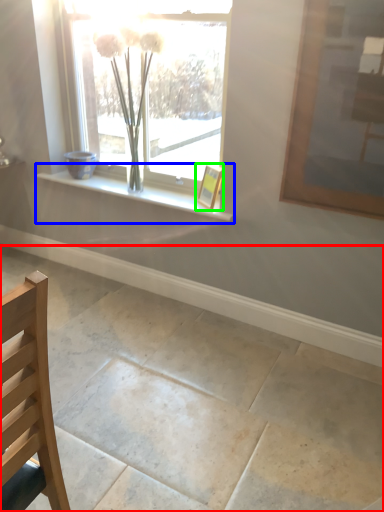
Question: Considering the real-world distances, which object is closest to concrete (highlighted by a red box)? window sill (highlighted by a blue box) or picture frame (highlighted by a green box).

Choices:
 (A) window sill
 (B) picture frame

Answer: (A)